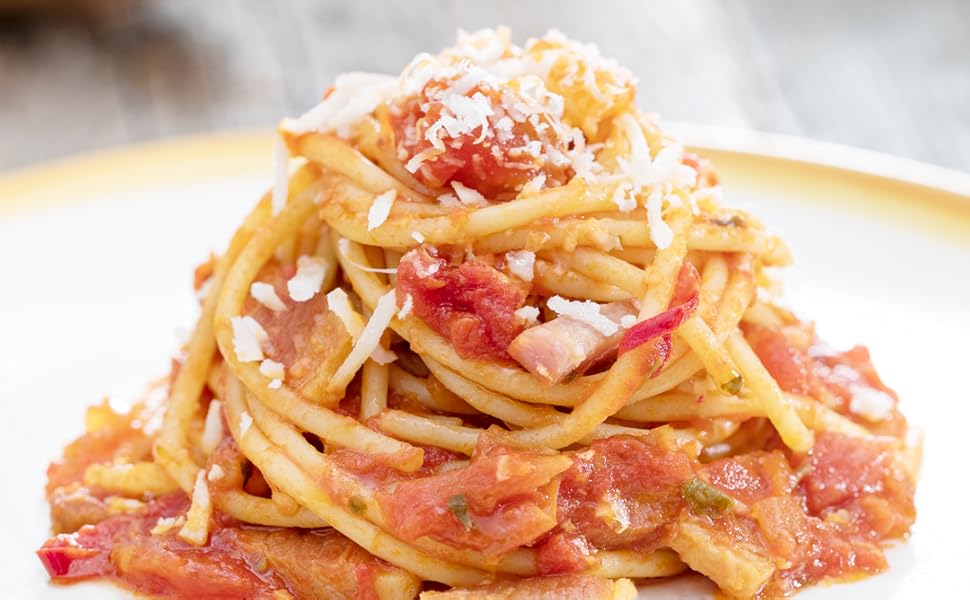
The width and height of the screenshot is (970, 600). In order to click on yellow rim of plate in this screenshot , I will do `click(888, 185)`.